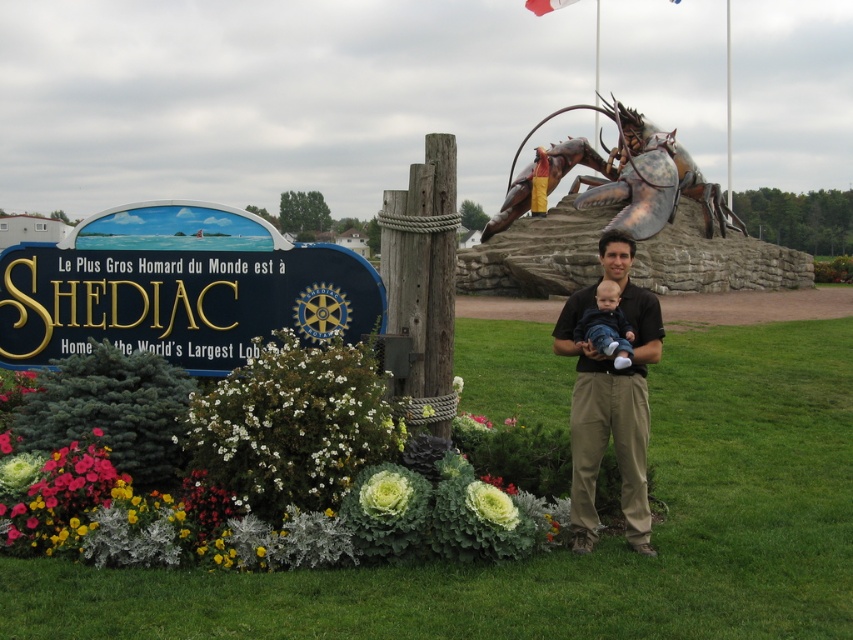
Question: Does white fluffy bush at lower center appear on the right side of green leafy at lower center?

Choices:
 (A) yes
 (B) no

Answer: (B)

Question: Which object is the closest to the white fluffy bush at lower center?

Choices:
 (A) green leafy at lower center
 (B) copper metallic lobster at upper center

Answer: (A)

Question: Which of the following is the farthest from the observer?

Choices:
 (A) (572, 467)
 (B) (244, 458)
 (C) (595, 348)

Answer: (A)

Question: Does black cotton shirt at center appear over copper metallic lobster at upper center?

Choices:
 (A) no
 (B) yes

Answer: (A)

Question: Does black plastic sign at left have a lesser width compared to white fluffy bush at lower center?

Choices:
 (A) yes
 (B) no

Answer: (B)

Question: Estimate the real-world distances between objects in this image. Which object is closer to the copper metallic lobster at upper center?

Choices:
 (A) green leafy at lower center
 (B) black cotton shirt at center
 (C) white fluffy bush at lower center
 (D) white leafy at lower center

Answer: (C)